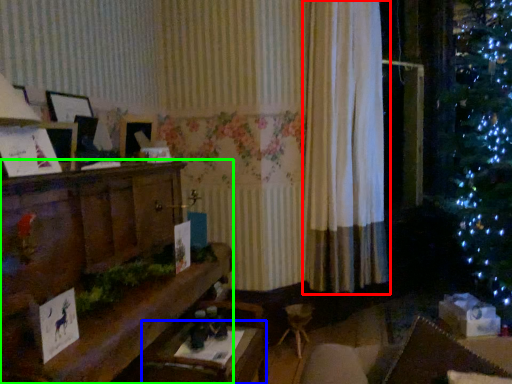
Question: Which object is the closest to the curtain (highlighted by a red box)? Choose among these: table (highlighted by a blue box) or furniture (highlighted by a green box).

Choices:
 (A) table
 (B) furniture

Answer: (B)